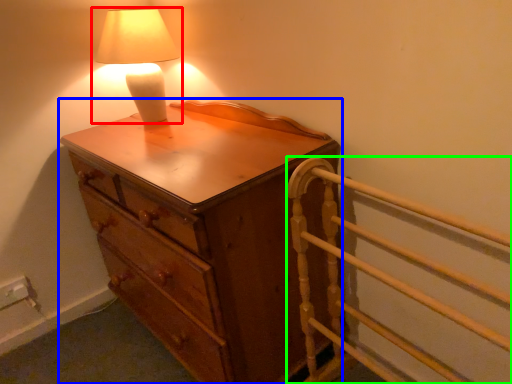
Question: Which object is the farthest from lamp (highlighted by a red box)? Choose among these: chest of drawers (highlighted by a blue box) or bed frame (highlighted by a green box).

Choices:
 (A) chest of drawers
 (B) bed frame

Answer: (B)